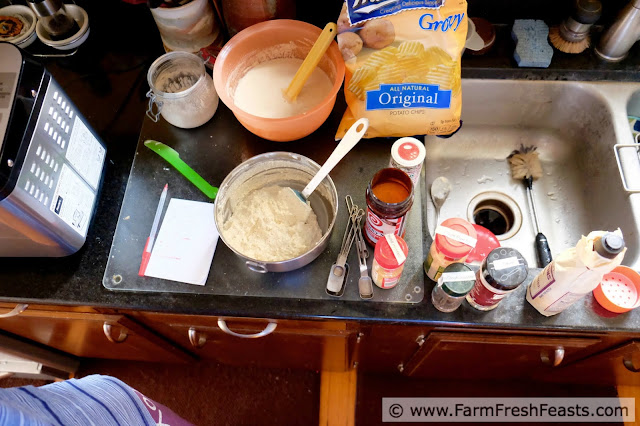
Where is `silver drawer handle`? The width and height of the screenshot is (640, 426). silver drawer handle is located at coordinates (246, 333).